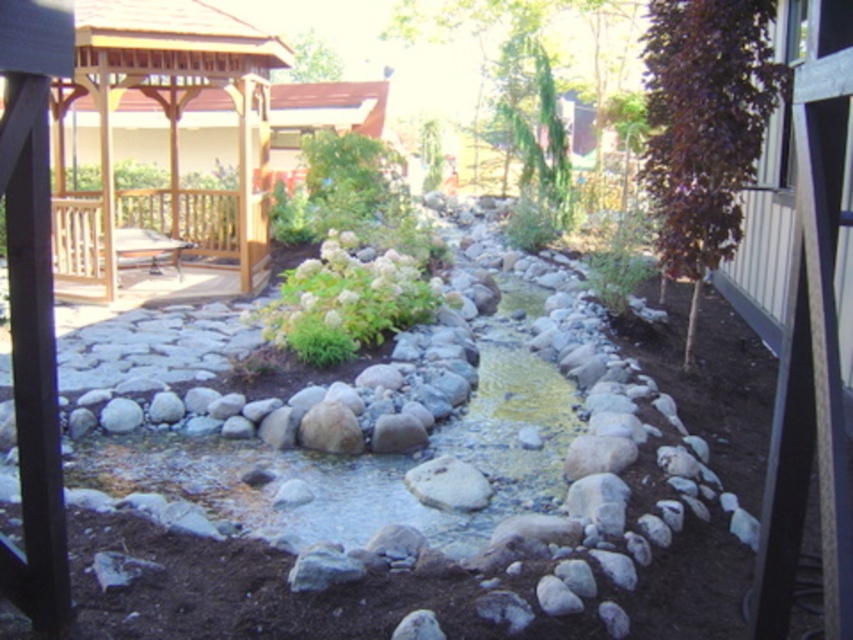
Question: Which object is positioned farthest from the wooden bench at left?

Choices:
 (A) wooden gazebo at upper left
 (B) white fluffy bush at center

Answer: (B)

Question: Is wooden gazebo at upper left bigger than wooden bench at left?

Choices:
 (A) yes
 (B) no

Answer: (A)

Question: Which of the following is the closest to the observer?

Choices:
 (A) (62, 198)
 (B) (252, 195)
 (C) (399, 276)

Answer: (C)

Question: Is wooden bench at left bigger than white fluffy bush at center?

Choices:
 (A) yes
 (B) no

Answer: (A)

Question: Among these objects, which one is nearest to the camera?

Choices:
 (A) wooden bench at left
 (B) white fluffy bush at center

Answer: (B)

Question: In this image, where is wooden gazebo at upper left located relative to white fluffy bush at center?

Choices:
 (A) above
 (B) below

Answer: (A)